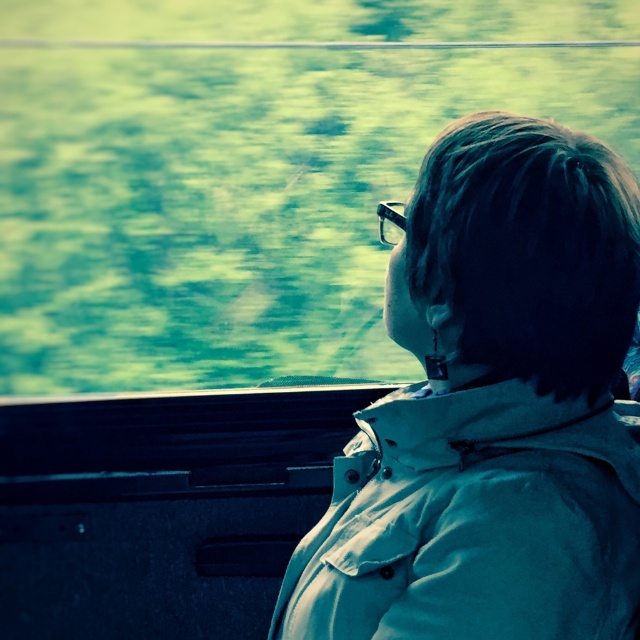
Which is in front, point (364, 234) or point (570, 499)?

Positioned in front is point (570, 499).

Who is more distant from viewer, (113, 96) or (477, 596)?

Point (113, 96)

The height and width of the screenshot is (640, 640). In order to click on transparent glass train window at center in this screenshot , I will do `click(236, 198)`.

Between point (138, 56) and point (385, 220), which one is positioned in front?

Point (385, 220)

Who is more distant from viewer, (76, 275) or (396, 212)?

Positioned behind is point (76, 275).

The width and height of the screenshot is (640, 640). Find the location of `transparent glass train window at center`. transparent glass train window at center is located at coordinates (236, 198).

Who is higher up, white matte jacket at center or clear plastic goggles at center?

clear plastic goggles at center

Which is more to the right, white matte jacket at center or clear plastic goggles at center?

white matte jacket at center

What do you see at coordinates (492, 408) in the screenshot? I see `white matte jacket at center` at bounding box center [492, 408].

At what (x,y) coordinates should I click in order to perform the action: click on white matte jacket at center. Please return your answer as a coordinate pair (x, y). Looking at the image, I should click on (492, 408).